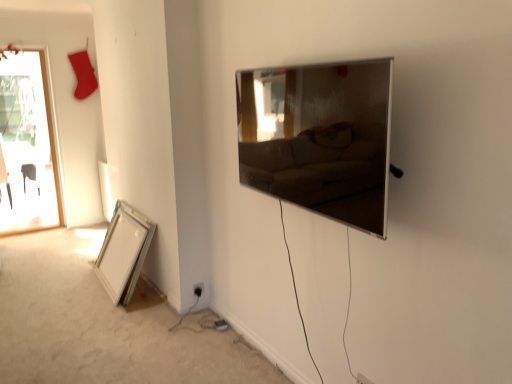
Question: Is silver metallic picture frame at lower left, the 1th picture frame positioned from the left, to the left of satin silver tv at upper right, arranged as the second picture frame when ordered from the bottom, from the viewer's perspective?

Choices:
 (A) yes
 (B) no

Answer: (A)

Question: Is the depth of silver metallic picture frame at lower left, positioned as the second picture frame in front-to-back order, greater than that of satin silver tv at upper right, which is the 2th picture frame from left to right?

Choices:
 (A) yes
 (B) no

Answer: (A)

Question: Is silver metallic picture frame at lower left, the 1th picture frame from the back, taller than satin silver tv at upper right, arranged as the second picture frame when ordered from the bottom?

Choices:
 (A) no
 (B) yes

Answer: (B)

Question: Considering the relative sizes of silver metallic picture frame at lower left, the 1th picture frame when ordered from bottom to top, and satin silver tv at upper right, arranged as the second picture frame when ordered from the bottom, in the image provided, is silver metallic picture frame at lower left, the 1th picture frame when ordered from bottom to top, wider than satin silver tv at upper right, arranged as the second picture frame when ordered from the bottom,?

Choices:
 (A) no
 (B) yes

Answer: (B)

Question: Could you tell me if silver metallic picture frame at lower left, which ranks as the 2th picture frame in top-to-bottom order, is facing satin silver tv at upper right, which is the 2th picture frame from left to right?

Choices:
 (A) no
 (B) yes

Answer: (A)

Question: Considering their positions, is satin silver tv at upper right, arranged as the 1th picture frame when viewed from the front, located in front of or behind silver metallic picture frame at lower left, the 1th picture frame from the back?

Choices:
 (A) front
 (B) behind

Answer: (A)

Question: Is satin silver tv at upper right, which is the 2th picture frame from left to right, wider or thinner than silver metallic picture frame at lower left, the 1th picture frame from the back?

Choices:
 (A) thin
 (B) wide

Answer: (A)

Question: Do you think satin silver tv at upper right, arranged as the first picture frame when viewed from the top, is within silver metallic picture frame at lower left, the 1th picture frame positioned from the left, or outside of it?

Choices:
 (A) outside
 (B) inside

Answer: (A)

Question: Considering the positions of satin silver tv at upper right, arranged as the second picture frame when ordered from the bottom, and silver metallic picture frame at lower left, positioned as the second picture frame in front-to-back order, in the image, is satin silver tv at upper right, arranged as the second picture frame when ordered from the bottom, bigger or smaller than silver metallic picture frame at lower left, positioned as the second picture frame in front-to-back order,?

Choices:
 (A) small
 (B) big

Answer: (A)

Question: Would you say black plastic electric outlet at lower center, the 1th electric outlet when ordered from left to right, is to the left or to the right of white plastic electric outlet at lower center, positioned as the 1th electric outlet in bottom-to-top order, in the picture?

Choices:
 (A) right
 (B) left

Answer: (B)

Question: In terms of size, does black plastic electric outlet at lower center, marked as the 2th electric outlet in a front-to-back arrangement, appear bigger or smaller than white plastic electric outlet at lower center, the first electric outlet when ordered from front to back?

Choices:
 (A) small
 (B) big

Answer: (A)

Question: From a real-world perspective, is black plastic electric outlet at lower center, arranged as the 1th electric outlet when viewed from the back, physically located above or below white plastic electric outlet at lower center, the first electric outlet when ordered from front to back?

Choices:
 (A) below
 (B) above

Answer: (A)

Question: Is point (197, 291) positioned closer to the camera than point (368, 382)?

Choices:
 (A) closer
 (B) farther

Answer: (B)

Question: Considering the positions of black plastic electric outlet at lower center, the 1th electric outlet when ordered from left to right, and silver metallic picture frame at lower left, the 1th picture frame when ordered from bottom to top, in the image, is black plastic electric outlet at lower center, the 1th electric outlet when ordered from left to right, taller or shorter than silver metallic picture frame at lower left, the 1th picture frame when ordered from bottom to top,?

Choices:
 (A) short
 (B) tall

Answer: (A)

Question: Considering the positions of point (198, 294) and point (114, 264), is point (198, 294) closer or farther from the camera than point (114, 264)?

Choices:
 (A) farther
 (B) closer

Answer: (B)